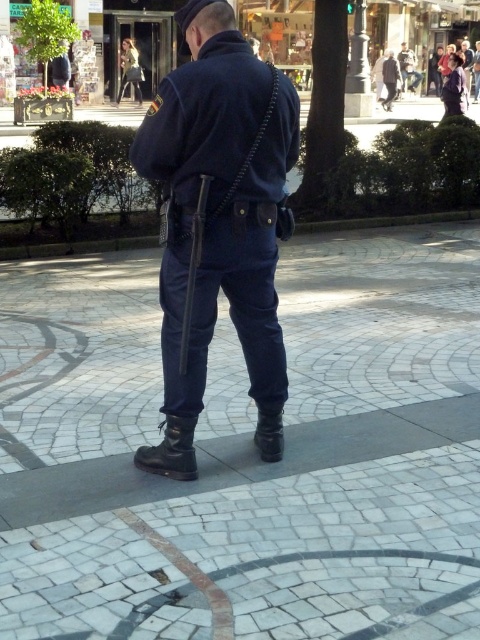
Question: Does navy blue fabric uniform at center have a greater width compared to polished metal pole at upper center?

Choices:
 (A) no
 (B) yes

Answer: (A)

Question: Which of the following is the closest to the observer?

Choices:
 (A) (78, 339)
 (B) (468, 51)
 (C) (420, 74)
 (D) (456, 99)

Answer: (A)

Question: Estimate the real-world distances between objects in this image. Which object is closer to the dark blue fabric uniform at center?

Choices:
 (A) matte blue uniform at center
 (B) polished metal pole at upper center

Answer: (B)

Question: Which point appears farthest from the camera in this image?

Choices:
 (A) (414, 74)
 (B) (394, 97)
 (C) (459, 88)

Answer: (A)

Question: Can you confirm if polished metal pole at upper center is positioned to the left of dark blue uniform at center?

Choices:
 (A) no
 (B) yes

Answer: (B)

Question: Is white stone pavement at center wider than navy blue fabric uniform at center?

Choices:
 (A) no
 (B) yes

Answer: (B)